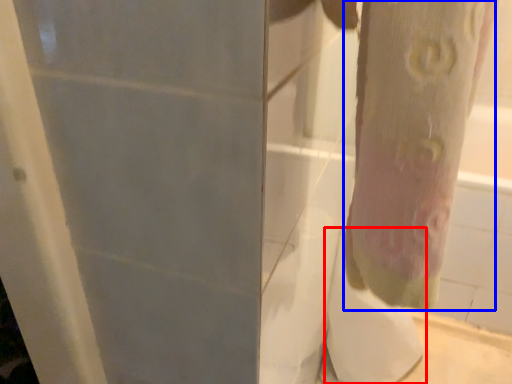
Question: Which of the following is the closest to the observer, toilet paper (highlighted by a red box) or tree trunk (highlighted by a blue box)?

Choices:
 (A) toilet paper
 (B) tree trunk

Answer: (B)